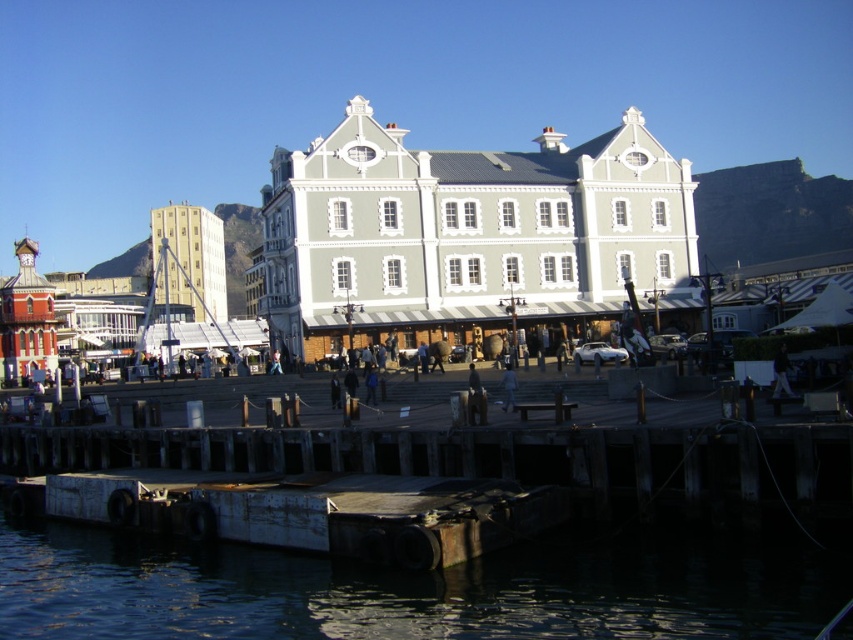
You are a photographer standing at the waterfront scene. You want to capture both the dark gray water at lower left and the dark gray jacket at center in the same frame. Which object will appear wider in your photo?

The dark gray water at lower left will appear wider in the photo since its width surpasses that of the dark gray jacket at center according to the description.

You are standing on the dock and want to reach the water to take a photo. Which direction should you move from the rusty metal dock at lower center to get to the dark gray water at lower left?

You should move to the right from the rusty metal dock at lower center to reach the dark gray water at lower left because the dark gray water at lower left is positioned to the right of the rusty metal dock at lower center.

You are a tour guide leading a group on the dock. You need to move a heavy box from the rusty metal dock at lower center to the dark gray water at lower left for a demonstration. Can you safely place the box directly into the water without moving more than 3 meters from the dock?

The distance between the rusty metal dock at lower center and the dark gray water at lower left is 3.82 meters. Since the box would need to be moved 3.82 meters to reach the water, which exceeds the 3 meters limit, you cannot safely place the box directly into the water without moving more than 3 meters from the dock.